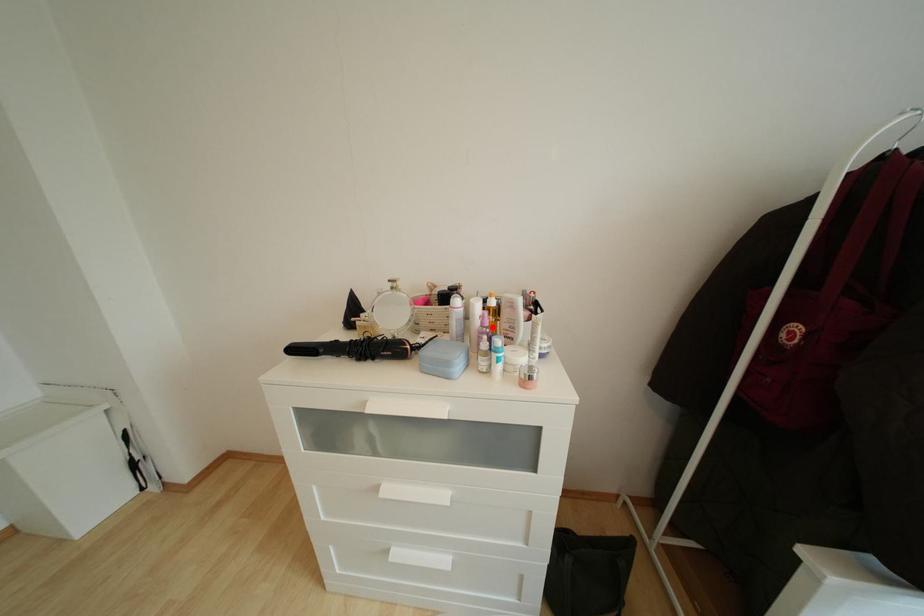
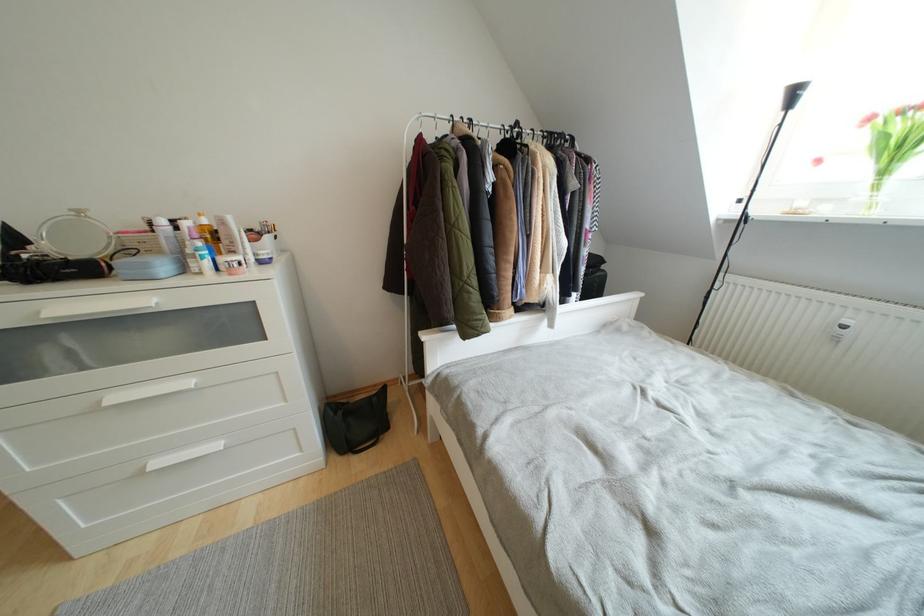
In the second image, find the point that corresponds to the highlighted location in the first image.

(201, 240)